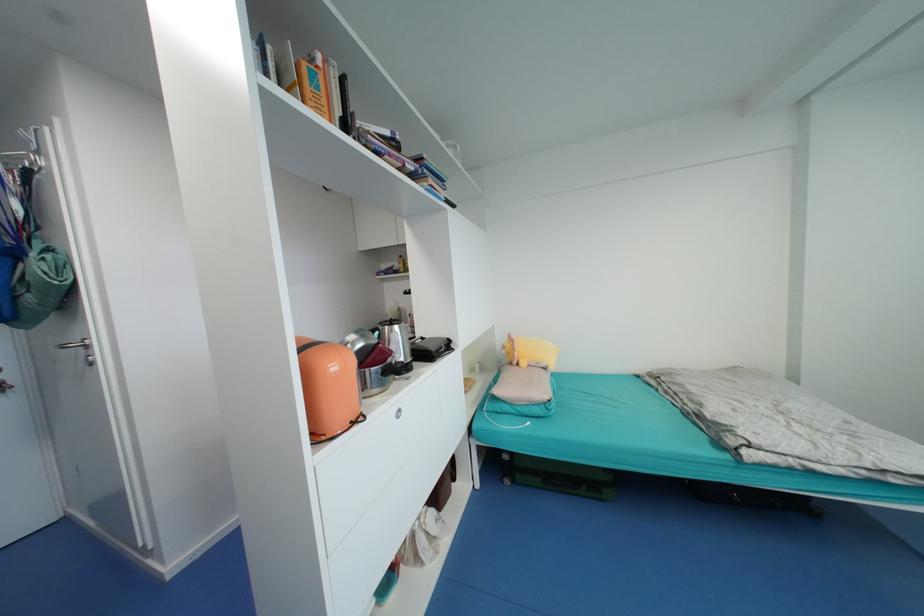
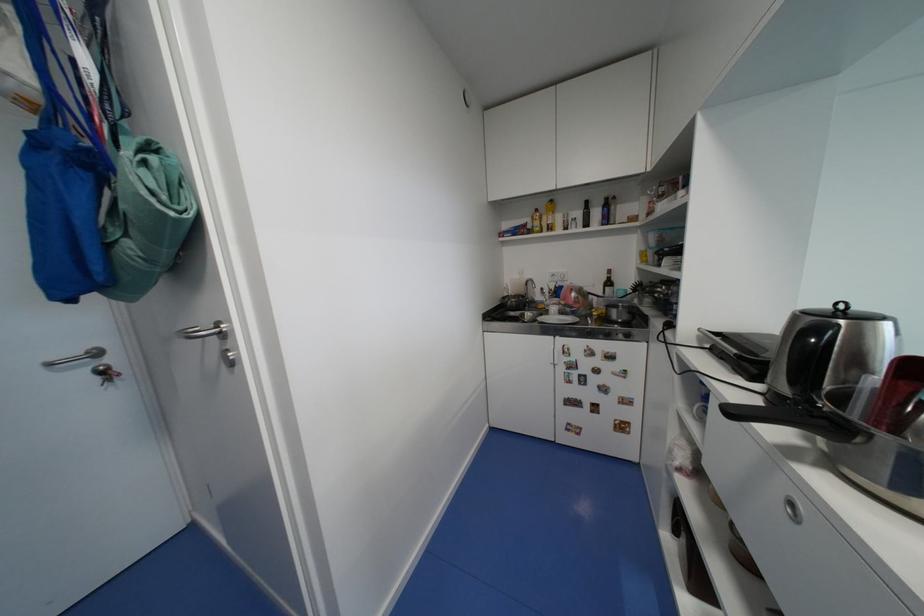
The images are taken continuously from a first-person perspective. In which direction are you moving?

The movement direction of the cameraman is left, forward.